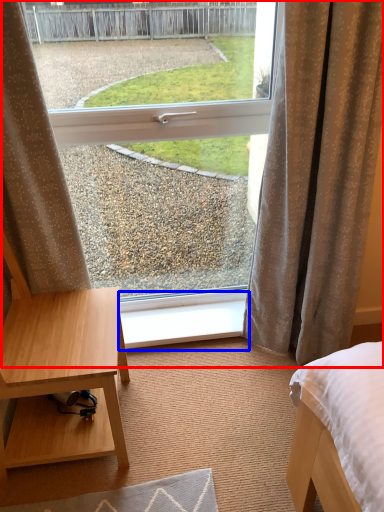
Question: Which object appears closest to the camera in this image, window (highlighted by a red box) or window sill (highlighted by a blue box)?

Choices:
 (A) window
 (B) window sill

Answer: (A)